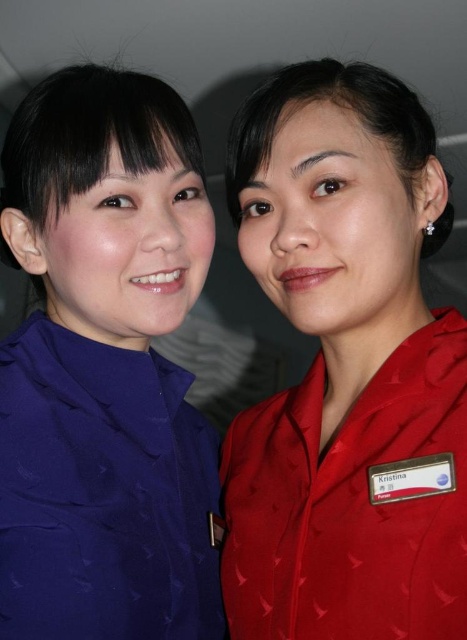
Is matte red uniform at right thinner than matte blue shirt at left?

No.

Is point (360, 403) positioned in front of point (40, 557)?

No, it is behind (40, 557).

The height and width of the screenshot is (640, 467). What are the coordinates of `matte red uniform at right` in the screenshot? It's located at (346, 371).